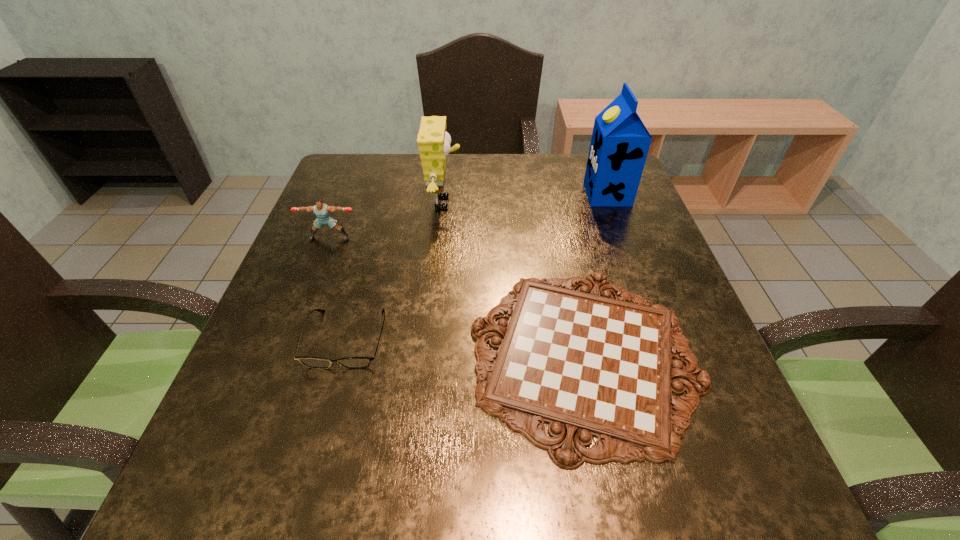
In order to click on vacant space that satisfies the following two spatial constraints: 1. on the front-facing side of the fourth shortest object; 2. on the back side of the shortest object in this screenshot , I will do `click(429, 355)`.

What are the coordinates of `vacant space that satisfies the following two spatial constraints: 1. on the front-facing side of the chessboard; 2. on the left side of the spectacles` in the screenshot? It's located at (342, 355).

In order to click on free location that satisfies the following two spatial constraints: 1. with the cap open on the carton; 2. on the front-facing side of the fourth tallest object in this screenshot , I will do `click(660, 339)`.

You are a GUI agent. You are given a task and a screenshot of the screen. Output one action in this format:
    pyautogui.click(x=<x>, y=<y>)
    Task: Click on the vacant space that satisfies the following two spatial constraints: 1. on the front-facing side of the shortest object; 2. on the right side of the third shortest object
    The width and height of the screenshot is (960, 540).
    Given the screenshot: What is the action you would take?
    pyautogui.click(x=284, y=355)

You are a GUI agent. You are given a task and a screenshot of the screen. Output one action in this format:
    pyautogui.click(x=<x>, y=<y>)
    Task: Click on the vacant area in the image that satisfies the following two spatial constraints: 1. with the cap open on the tallest object; 2. on the front-facing side of the spectacles
    Image resolution: width=960 pixels, height=540 pixels.
    Given the screenshot: What is the action you would take?
    pyautogui.click(x=660, y=339)

I want to click on vacant area in the image that satisfies the following two spatial constraints: 1. on the front-facing side of the puncher; 2. on the left side of the shortest object, so click(x=284, y=355).

The image size is (960, 540). I want to click on vacant area in the image that satisfies the following two spatial constraints: 1. on the front-facing side of the third object from right to left; 2. on the front-facing side of the puncher, so click(x=441, y=238).